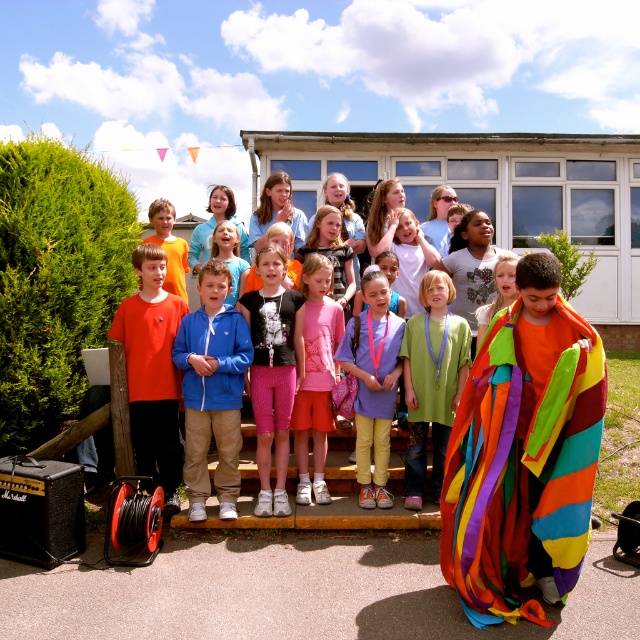
Between pink fabric at center and rainbow fabric blanket at right, which one appears on the left side from the viewer's perspective?

Positioned to the left is pink fabric at center.

Is pink fabric at center above rainbow fabric blanket at right?

Indeed, pink fabric at center is positioned over rainbow fabric blanket at right.

At what (x,y) coordinates should I click in order to perform the action: click on pink fabric at center. Please return your answer as a coordinate pair (x, y). Looking at the image, I should click on (228, 257).

Is blue fleece jacket at center in front of pink fabric at center?

Yes, blue fleece jacket at center is closer to the viewer.

Which of these two, blue fleece jacket at center or pink fabric at center, stands taller?

blue fleece jacket at center

Is point (186, 394) positioned before point (230, 301)?

That is True.

The height and width of the screenshot is (640, 640). Find the location of `blue fleece jacket at center`. blue fleece jacket at center is located at coordinates (212, 390).

Can you confirm if matte orange shirt at left is positioned to the right of orange cotton shirt at center?

Indeed, matte orange shirt at left is positioned on the right side of orange cotton shirt at center.

Which of these two, matte orange shirt at left or orange cotton shirt at center, stands shorter?

orange cotton shirt at center

Locate an element on the screen. Image resolution: width=640 pixels, height=640 pixels. matte orange shirt at left is located at coordinates (152, 372).

Locate an element on the screen. The height and width of the screenshot is (640, 640). matte orange shirt at left is located at coordinates (152, 372).